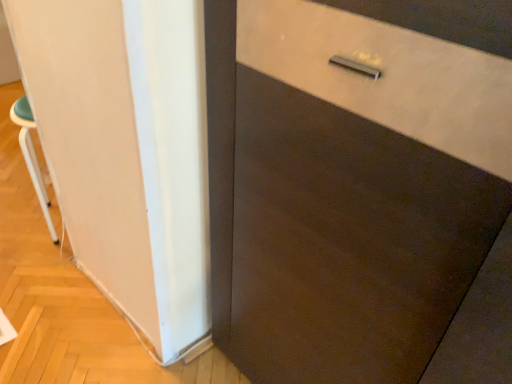
Image resolution: width=512 pixels, height=384 pixels. Find the location of `vacant space that's between white plastic stool at left and white matte barn door at left`. vacant space that's between white plastic stool at left and white matte barn door at left is located at coordinates (71, 310).